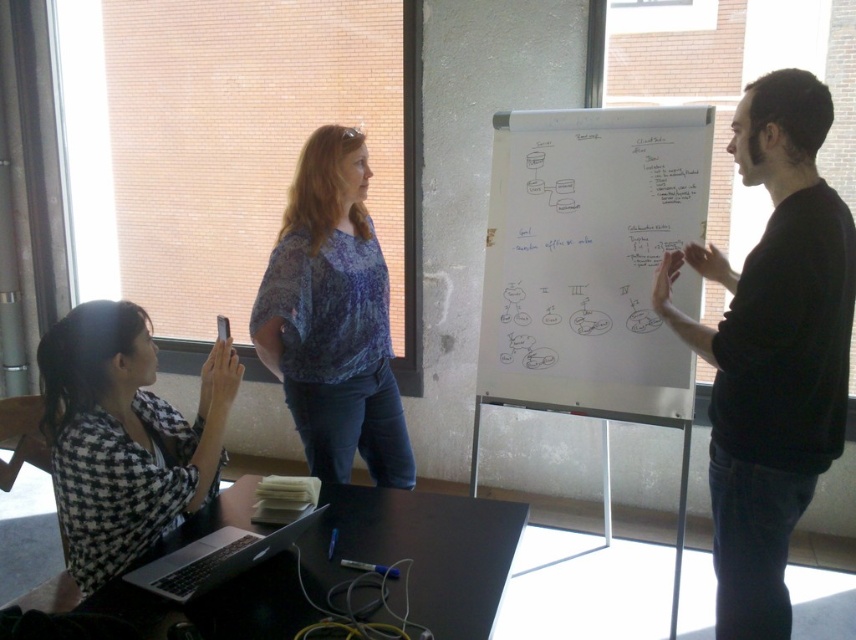
Can you confirm if blue printed blouse at center is wider than silver metallic laptop at lower left?

Correct, the width of blue printed blouse at center exceeds that of silver metallic laptop at lower left.

Describe the element at coordinates (333, 317) in the screenshot. I see `blue printed blouse at center` at that location.

The image size is (856, 640). I want to click on blue printed blouse at center, so click(x=333, y=317).

Who is more forward, (140, 493) or (284, 534)?

Point (284, 534) is more forward.

Measure the distance between point (56, 396) and camera.

Point (56, 396) is 5.68 feet away from camera.

Identify the location of black checkered shirt at lower left. (123, 436).

Which is more to the left, black matte shirt at right or blue printed blouse at center?

blue printed blouse at center is more to the left.

The image size is (856, 640). Describe the element at coordinates (771, 349) in the screenshot. I see `black matte shirt at right` at that location.

The height and width of the screenshot is (640, 856). I want to click on black matte shirt at right, so click(771, 349).